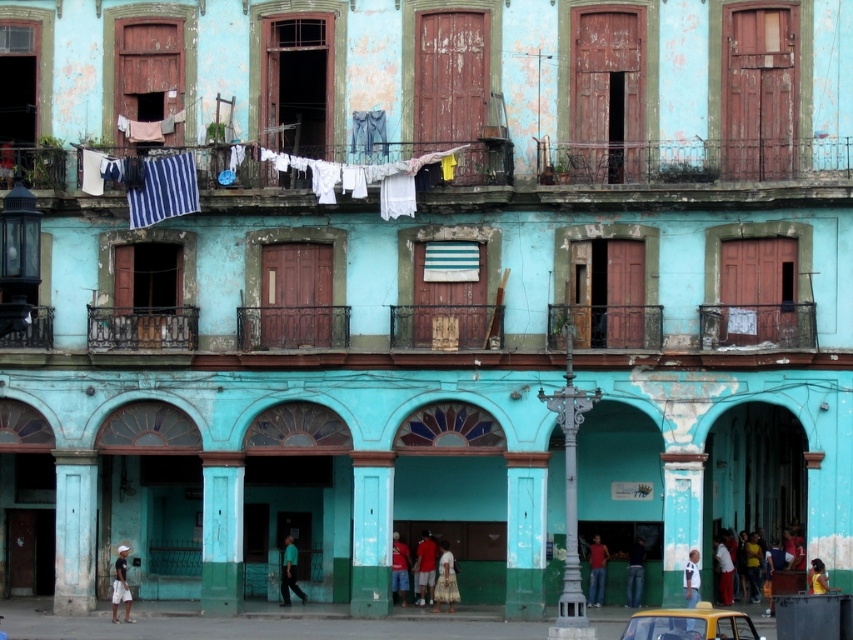
Question: Can you confirm if white fabric at upper center is wider than green matte shirt at lower center?

Choices:
 (A) no
 (B) yes

Answer: (B)

Question: Does white fabric at upper center have a greater width compared to red fabric pants at center?

Choices:
 (A) no
 (B) yes

Answer: (B)

Question: Does jeans at lower center have a greater width compared to green matte shirt at lower center?

Choices:
 (A) no
 (B) yes

Answer: (A)

Question: Which object appears farthest from the camera in this image?

Choices:
 (A) white fabric at lower right
 (B) red fabric pants at center

Answer: (B)

Question: Which object is farther from the camera taking this photo?

Choices:
 (A) white matte shirt at lower right
 (B) green matte shirt at lower center
 (C) yellow fabric person at lower right

Answer: (B)

Question: Among these objects, which one is farthest from the camera?

Choices:
 (A) white matte shirt at lower right
 (B) green matte shirt at lower center
 (C) red fabric pants at lower center
 (D) white fabric at lower right

Answer: (B)